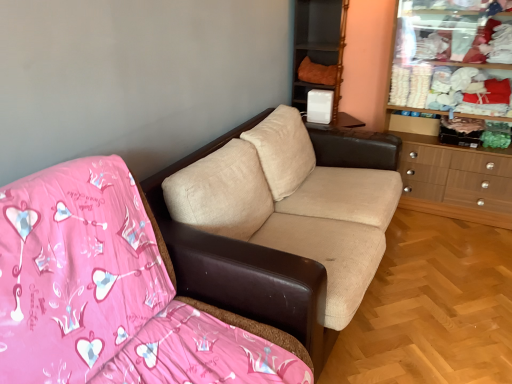
Question: Is beige fabric couch at center, which is counted as the 1th studio couch, starting from the back, smaller than orange fabric cushion at upper center?

Choices:
 (A) yes
 (B) no

Answer: (B)

Question: Can you confirm if beige fabric couch at center, which is the second studio couch from front to back, is positioned to the right of orange fabric cushion at upper center?

Choices:
 (A) yes
 (B) no

Answer: (A)

Question: Can you confirm if beige fabric couch at center, which is the second studio couch from front to back, is thinner than orange fabric cushion at upper center?

Choices:
 (A) yes
 (B) no

Answer: (B)

Question: From the image's perspective, is beige fabric couch at center, which is the second studio couch from front to back, over orange fabric cushion at upper center?

Choices:
 (A) yes
 (B) no

Answer: (B)

Question: Does beige fabric couch at center, which is counted as the 1th studio couch, starting from the back, come behind orange fabric cushion at upper center?

Choices:
 (A) yes
 (B) no

Answer: (B)

Question: In terms of width, does wooden dresser at right look wider or thinner when compared to beige fabric couch at center, which is counted as the 1th studio couch, starting from the back?

Choices:
 (A) wide
 (B) thin

Answer: (B)

Question: From their relative heights in the image, would you say wooden dresser at right is taller or shorter than beige fabric couch at center, which is the second studio couch from front to back?

Choices:
 (A) short
 (B) tall

Answer: (B)

Question: Is wooden dresser at right inside the boundaries of beige fabric couch at center, which is counted as the 1th studio couch, starting from the back, or outside?

Choices:
 (A) outside
 (B) inside

Answer: (A)

Question: From a real-world perspective, is wooden dresser at right positioned above or below beige fabric couch at center, which is counted as the 1th studio couch, starting from the back?

Choices:
 (A) below
 (B) above

Answer: (B)

Question: In terms of size, does orange fabric cushion at upper center appear bigger or smaller than beige fabric couch at center, which is the second studio couch from front to back?

Choices:
 (A) big
 (B) small

Answer: (B)

Question: Considering their positions, is orange fabric cushion at upper center located in front of or behind beige fabric couch at center, which is counted as the 1th studio couch, starting from the back?

Choices:
 (A) behind
 (B) front

Answer: (A)

Question: Is point (304, 72) closer or farther from the camera than point (189, 231)?

Choices:
 (A) farther
 (B) closer

Answer: (A)

Question: Considering the positions of orange fabric cushion at upper center and beige fabric couch at center, which is counted as the 1th studio couch, starting from the back, in the image, is orange fabric cushion at upper center taller or shorter than beige fabric couch at center, which is counted as the 1th studio couch, starting from the back,?

Choices:
 (A) short
 (B) tall

Answer: (B)

Question: In terms of width, does beige fabric couch at center, the first studio couch when ordered from front to back, look wider or thinner when compared to beige fabric couch at center, which is the second studio couch from front to back?

Choices:
 (A) thin
 (B) wide

Answer: (A)

Question: Is beige fabric couch at center, the first studio couch when ordered from front to back, situated inside beige fabric couch at center, which is the second studio couch from front to back, or outside?

Choices:
 (A) inside
 (B) outside

Answer: (B)